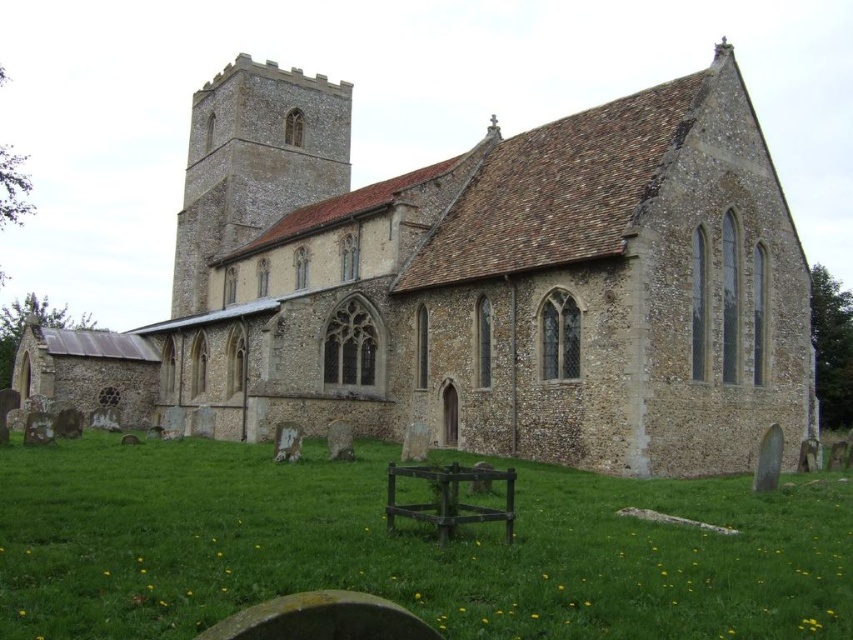
Question: Is brown stone church at center above green grass at lower center?

Choices:
 (A) yes
 (B) no

Answer: (A)

Question: Considering the relative positions of brown stone church at center and green grass at lower center in the image provided, where is brown stone church at center located with respect to green grass at lower center?

Choices:
 (A) below
 (B) above

Answer: (B)

Question: Among these points, which one is farthest from the camera?

Choices:
 (A) (553, 486)
 (B) (682, 90)

Answer: (B)

Question: Which object is farther from the camera taking this photo?

Choices:
 (A) brown stone church at center
 (B) green grass at lower center

Answer: (A)

Question: Is brown stone church at center bigger than green grass at lower center?

Choices:
 (A) yes
 (B) no

Answer: (A)

Question: Which point is closer to the camera?

Choices:
 (A) (415, 419)
 (B) (39, 497)

Answer: (B)